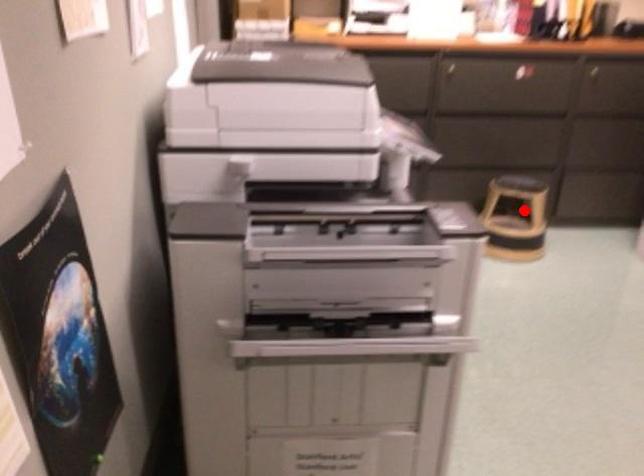
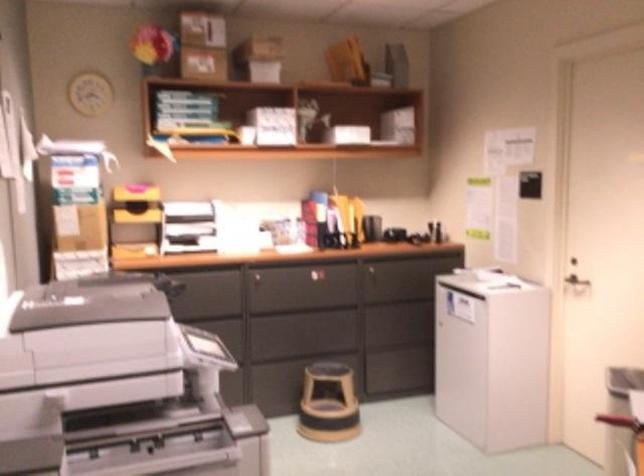
Question: I am providing you with two images of the same scene from different viewpoints. In image1, a red point is highlighted. Considering the same 3D point in image2, which of the following is correct?

Choices:
 (A) It is closer
 (B) It is farther

Answer: (B)